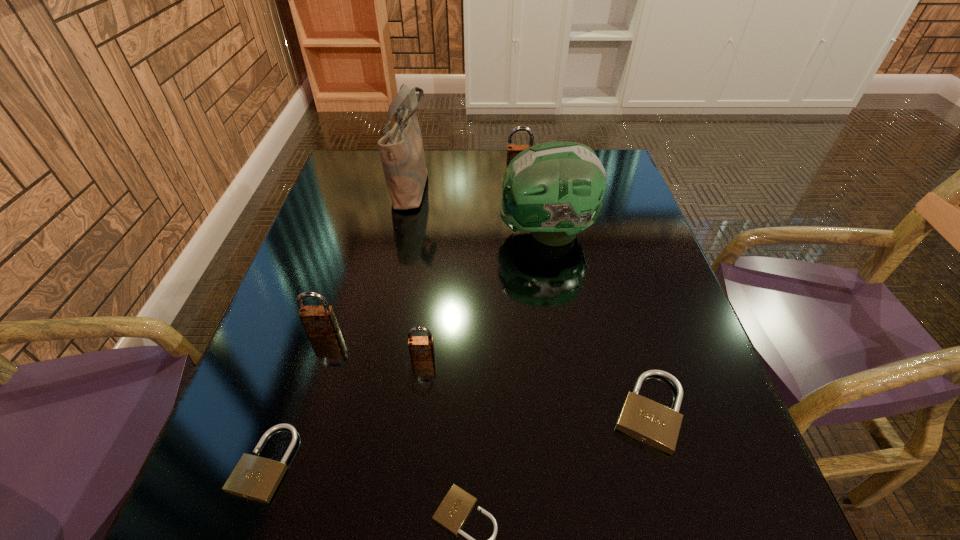
This screenshot has height=540, width=960. I want to click on free spot that satisfies the following two spatial constraints: 1. on the front-facing side of the tan shoulder bag; 2. on the front side of the second smallest beige padlock, so click(x=357, y=462).

This screenshot has height=540, width=960. What are the coordinates of `vacant space that satisfies the following two spatial constraints: 1. on the front-facing side of the fourth tallest padlock; 2. on the left side of the tan shoulder bag` in the screenshot? It's located at (367, 411).